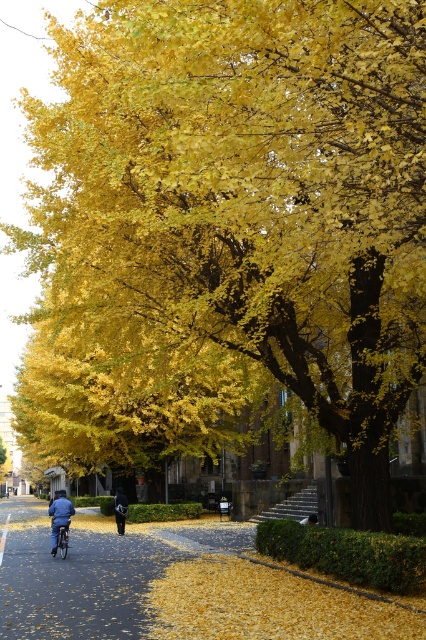
Between point (60, 534) and point (124, 497), which one is positioned in front?

Point (60, 534)

Does metallic silver bicycle at center appear under dark blue fabric jacket at center?

No, metallic silver bicycle at center is not below dark blue fabric jacket at center.

This screenshot has height=640, width=426. Identify the location of metallic silver bicycle at center. (60, 536).

Identify the location of metallic silver bicycle at center. This screenshot has width=426, height=640. (60, 536).